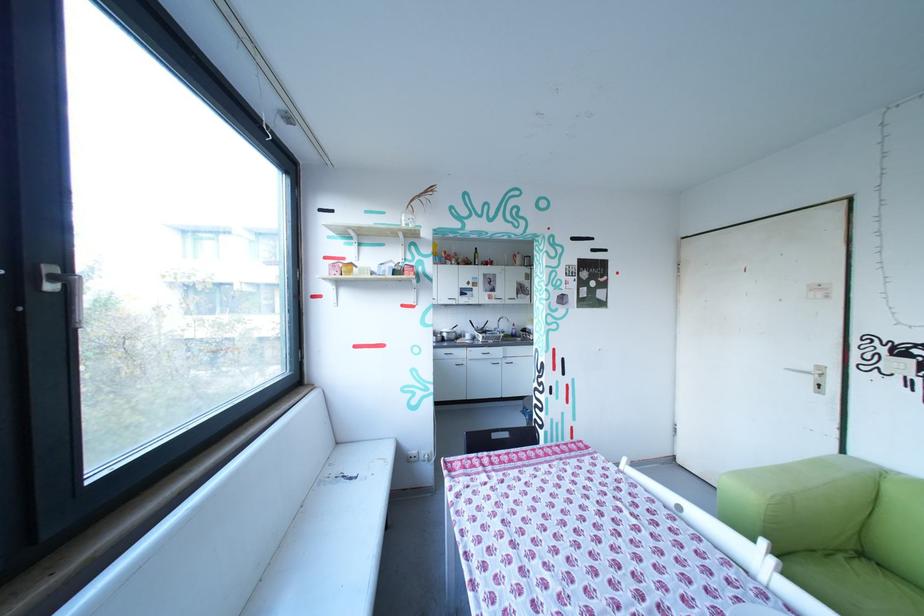
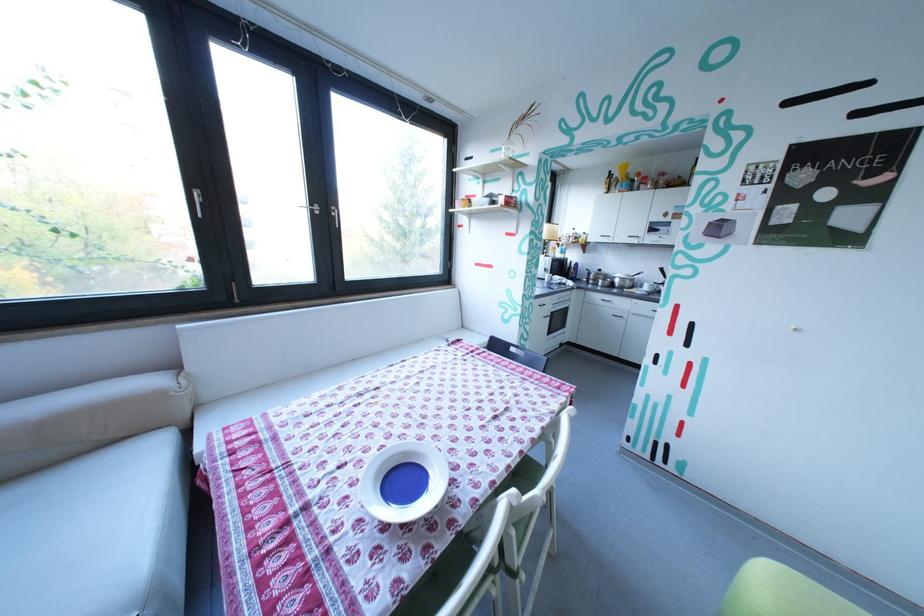
Find the pixel in the second image that matches the point at 457,334 in the first image.

(629, 281)